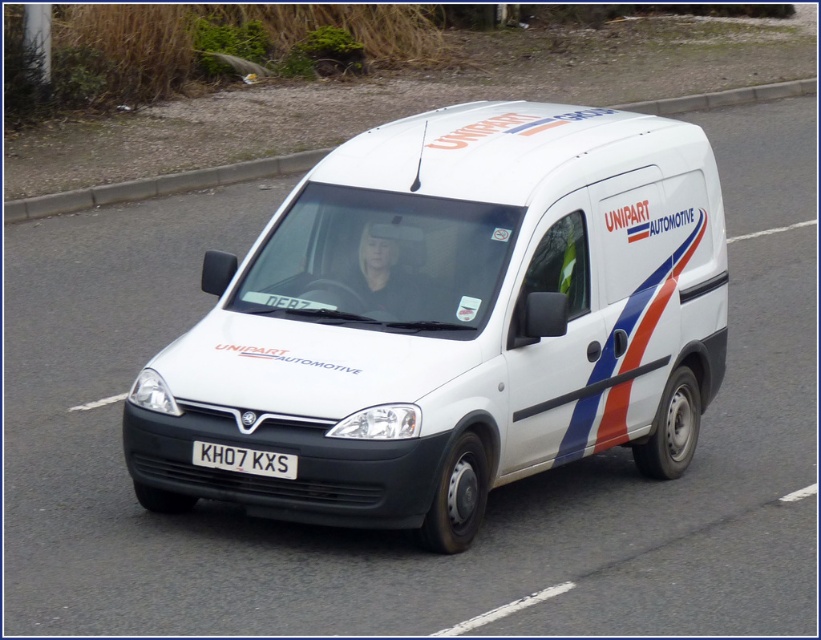
Does concrete at upper center appear under white plastic license plate at center?

Incorrect, concrete at upper center is not positioned below white plastic license plate at center.

Which is more to the left, concrete at upper center or white plastic license plate at center?

From the viewer's perspective, white plastic license plate at center appears more on the left side.

Is point (283, 173) positioned after point (205, 451)?

Yes, point (283, 173) is farther from viewer.

Image resolution: width=821 pixels, height=640 pixels. Find the location of `concrete at upper center`. concrete at upper center is located at coordinates (158, 186).

In the scene shown: How distant is white matte van at center from concrete at upper center?

white matte van at center is 8.63 meters away from concrete at upper center.

Does point (695, 417) come behind point (76, 193)?

That is False.

The height and width of the screenshot is (640, 821). What are the coordinates of `white matte van at center` in the screenshot? It's located at (452, 321).

Can you confirm if white matte van at center is taller than white plastic license plate at center?

Indeed, white matte van at center has a greater height compared to white plastic license plate at center.

Which of these two, white matte van at center or white plastic license plate at center, stands taller?

With more height is white matte van at center.

Where is `white matte van at center`? The image size is (821, 640). white matte van at center is located at coordinates (452, 321).

This screenshot has height=640, width=821. What are the coordinates of `white matte van at center` in the screenshot? It's located at (452, 321).